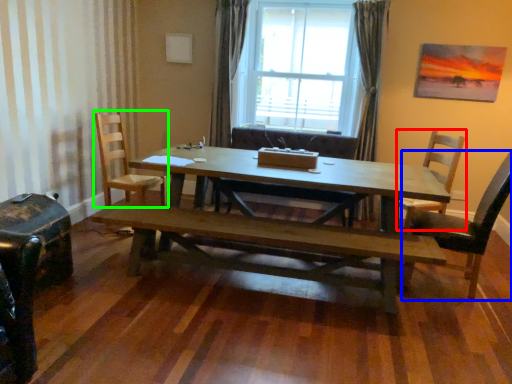
Question: Which object is positioned closest to chair (highlighted by a red box)? Select from chair (highlighted by a blue box) and chair (highlighted by a green box).

Choices:
 (A) chair
 (B) chair

Answer: (A)